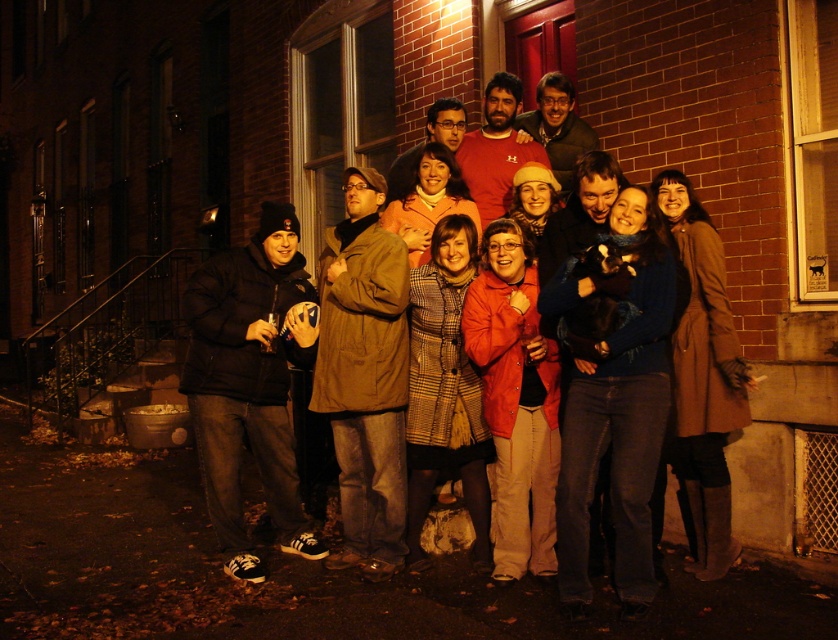
You are a photographer trying to adjust the focus on your camera. You need to ensure that both the black matte jacket at left and the brown matte coat at center are in focus. Given their heights, which one might require you to focus closer to the camera?

The black matte jacket at left has a lesser height compared to the brown matte coat at center, so it is closer to the camera. Therefore, focusing on the black matte jacket at left first would ensure both are in focus.